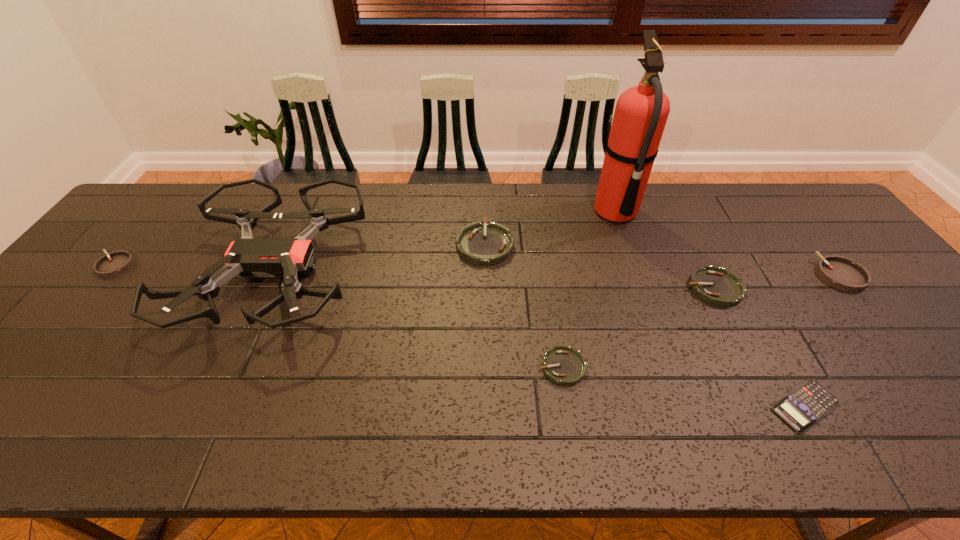
Locate an element on the screen. The width and height of the screenshot is (960, 540). object that is at the left edge is located at coordinates click(117, 262).

Where is `object positioned at the right edge`? The height and width of the screenshot is (540, 960). object positioned at the right edge is located at coordinates (839, 272).

Locate an element on the screen. free space at the far edge is located at coordinates (727, 212).

Find the location of `vacant space at the near edge of the desktop`. vacant space at the near edge of the desktop is located at coordinates (193, 432).

Where is `vacant space that is in between the fifth object from left to right and the bigger gray ashtray`? The image size is (960, 540). vacant space that is in between the fifth object from left to right and the bigger gray ashtray is located at coordinates (728, 244).

Locate an element on the screen. This screenshot has width=960, height=540. free spot between the farthest green ashtray and the nearest ashtray is located at coordinates (523, 306).

I want to click on free space between the leftmost object and the second tallest object, so click(x=196, y=269).

The width and height of the screenshot is (960, 540). In order to click on vacant space that's between the seventh object from right to left and the nearest ashtray in this screenshot , I will do `click(419, 319)`.

Find the location of `free space between the tallest object and the blue calculator`. free space between the tallest object and the blue calculator is located at coordinates (710, 309).

Find the location of a particular element. The width and height of the screenshot is (960, 540). free space between the rightmost object and the rightmost green ashtray is located at coordinates (777, 282).